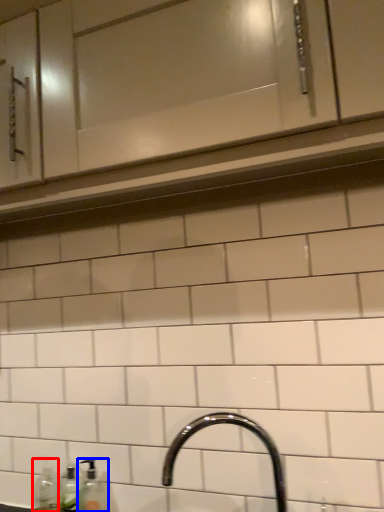
Question: Which point is closer to the camera, bottle (highlighted by a red box) or soap dispenser (highlighted by a blue box)?

Choices:
 (A) bottle
 (B) soap dispenser

Answer: (B)